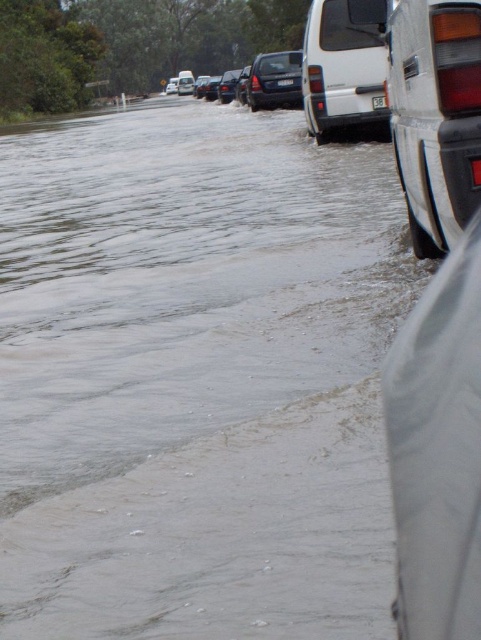
Based on the photo, which of these two, white matte van at center or black glossy sedan at center, stands shorter?

white matte van at center is shorter.

Can you confirm if white matte van at center is positioned to the left of black glossy sedan at center?

Incorrect, white matte van at center is not on the left side of black glossy sedan at center.

Describe the element at coordinates (341, 70) in the screenshot. The height and width of the screenshot is (640, 481). I see `white matte van at center` at that location.

You are a GUI agent. You are given a task and a screenshot of the screen. Output one action in this format:
    pyautogui.click(x=<x>, y=<y>)
    Task: Click on the white matte van at center
    The height and width of the screenshot is (640, 481).
    Given the screenshot: What is the action you would take?
    pyautogui.click(x=341, y=70)

Can you confirm if shiny black suv at center is wider than black glossy sedan at center?

Yes.

Does point (289, 60) lie behind point (209, 99)?

No, (289, 60) is closer to viewer.

At what (x,y) coordinates should I click in order to perform the action: click on shiny black suv at center. Please return your answer as a coordinate pair (x, y). Looking at the image, I should click on (275, 81).

Which is in front, point (327, 104) or point (232, 80)?

Positioned in front is point (327, 104).

Who is taller, white matte van at center or shiny metallic sedan at center?

With more height is shiny metallic sedan at center.

I want to click on white matte van at center, so click(x=341, y=70).